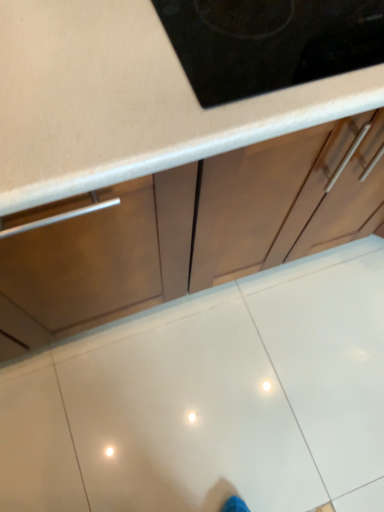
Question: From the image's perspective, is matte brown cabinet at center below white glossy tile at center?

Choices:
 (A) yes
 (B) no

Answer: (B)

Question: Can you confirm if matte brown cabinet at center is shorter than white glossy tile at center?

Choices:
 (A) yes
 (B) no

Answer: (B)

Question: Is the surface of matte brown cabinet at center in direct contact with white glossy tile at center?

Choices:
 (A) no
 (B) yes

Answer: (A)

Question: From a real-world perspective, is matte brown cabinet at center positioned under white glossy tile at center based on gravity?

Choices:
 (A) yes
 (B) no

Answer: (B)

Question: Is matte brown cabinet at center smaller than white glossy tile at center?

Choices:
 (A) no
 (B) yes

Answer: (A)

Question: Is the depth of matte brown cabinet at center greater than that of white glossy tile at center?

Choices:
 (A) yes
 (B) no

Answer: (B)

Question: From a real-world perspective, is white glossy tile at center on top of matte brown cabinet at center?

Choices:
 (A) no
 (B) yes

Answer: (A)

Question: Are white glossy tile at center and matte brown cabinet at center far apart?

Choices:
 (A) yes
 (B) no

Answer: (B)

Question: From the image's perspective, is white glossy tile at center on matte brown cabinet at center?

Choices:
 (A) no
 (B) yes

Answer: (A)

Question: Is white glossy tile at center completely or partially outside of matte brown cabinet at center?

Choices:
 (A) yes
 (B) no

Answer: (A)

Question: Is white glossy tile at center aimed at matte brown cabinet at center?

Choices:
 (A) yes
 (B) no

Answer: (B)

Question: Considering the relative positions of white glossy tile at center and matte brown cabinet at center in the image provided, is white glossy tile at center to the left of matte brown cabinet at center from the viewer's perspective?

Choices:
 (A) yes
 (B) no

Answer: (B)

Question: Is point (120, 415) closer or farther from the camera than point (59, 334)?

Choices:
 (A) closer
 (B) farther

Answer: (B)